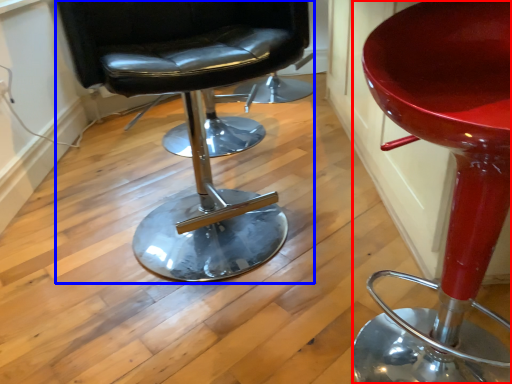
Question: Which object is closer to the camera taking this photo, chair (highlighted by a red box) or chair (highlighted by a blue box)?

Choices:
 (A) chair
 (B) chair

Answer: (A)